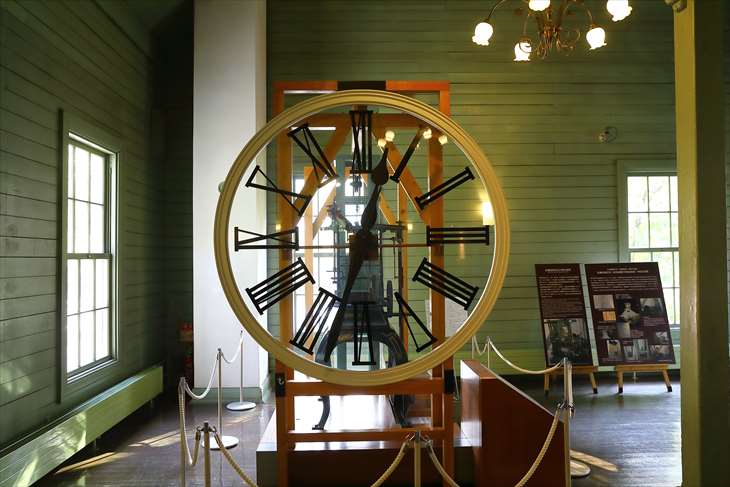
Identify the location of windows. This screenshot has height=487, width=730. (77, 177), (77, 303), (655, 193), (322, 235).